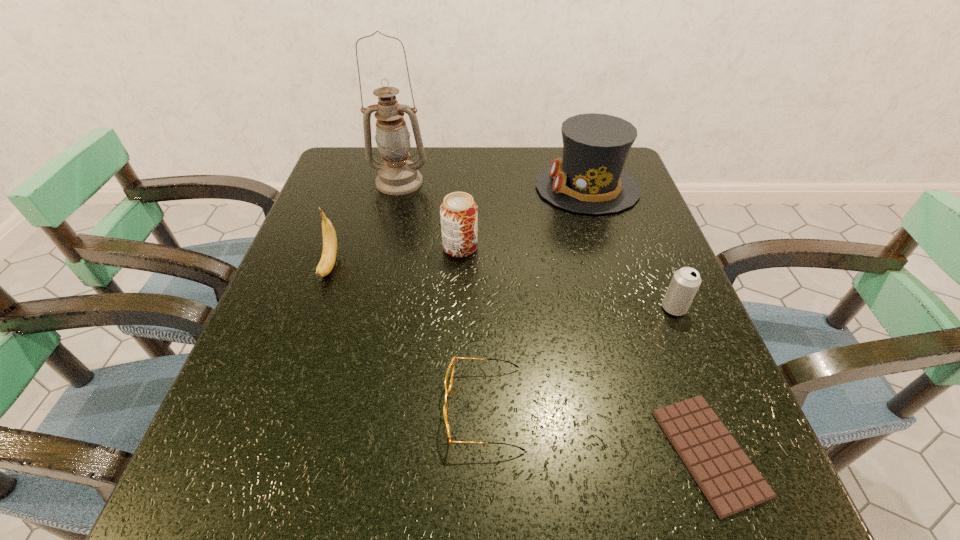
Locate an element on the screen. Image resolution: width=960 pixels, height=540 pixels. free region located on the left of the shortest object is located at coordinates (538, 453).

Where is `oil lamp that is at the far edge`? This screenshot has height=540, width=960. oil lamp that is at the far edge is located at coordinates (397, 176).

Locate an element on the screen. dress hat positioned at the far edge is located at coordinates (589, 179).

This screenshot has height=540, width=960. Identify the location of object present at the near edge. (731, 483).

Locate an element on the screen. oil lamp situated at the left edge is located at coordinates (397, 176).

At what (x,y) coordinates should I click in order to perform the action: click on banana that is at the left edge. Please return your answer as a coordinate pair (x, y). This screenshot has height=540, width=960. Looking at the image, I should click on (328, 258).

The height and width of the screenshot is (540, 960). I want to click on dress hat present at the right edge, so click(589, 179).

Find the location of `beer can that is at the right edge`. beer can that is at the right edge is located at coordinates (685, 282).

Identify the location of chocolate bar that is at the right edge. (731, 483).

Find the location of a particular element. The height and width of the screenshot is (540, 960). object that is at the far left corner is located at coordinates (397, 176).